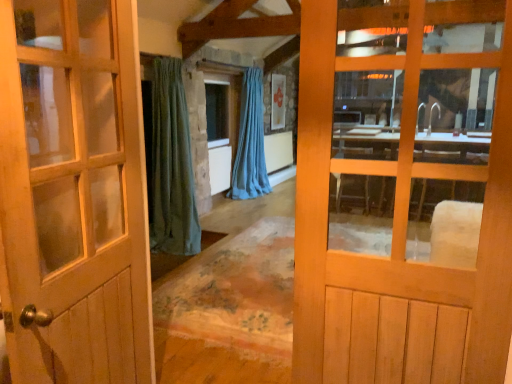
You are a GUI agent. You are given a task and a screenshot of the screen. Output one action in this format:
    pyautogui.click(x=<x>, y=<y>)
    Task: Click on the light brown wooden door at center, which is counted as the 2th door, starting from the left
    This screenshot has height=384, width=512.
    Given the screenshot: What is the action you would take?
    pyautogui.click(x=398, y=230)

What is the approximate width of blue fabric curtain at center?

blue fabric curtain at center is 22.01 inches in width.

The height and width of the screenshot is (384, 512). Find the location of `matte wooden door at center, positioned as the 2th door in right-to-left order`. matte wooden door at center, positioned as the 2th door in right-to-left order is located at coordinates (79, 214).

What do you see at coordinates (79, 214) in the screenshot? I see `matte wooden door at center, the first door in the left-to-right sequence` at bounding box center [79, 214].

The width and height of the screenshot is (512, 384). In order to click on clear glass window at center in this screenshot , I will do `click(223, 109)`.

You are a GUI agent. You are given a task and a screenshot of the screen. Output one action in this format:
    pyautogui.click(x=<x>, y=<y>)
    Task: Click on the light brown wooden door at center, which is counted as the 2th door, starting from the left
    This screenshot has height=384, width=512.
    Given the screenshot: What is the action you would take?
    pyautogui.click(x=398, y=230)

Considering the sizes of clear glass window at center and matte wooden door at center, the first door in the left-to-right sequence, in the image, is clear glass window at center taller or shorter than matte wooden door at center, the first door in the left-to-right sequence,?

Clearly, clear glass window at center is shorter compared to matte wooden door at center, the first door in the left-to-right sequence.

Is clear glass window at center looking in the opposite direction of matte wooden door at center, the first door in the left-to-right sequence?

clear glass window at center does not have its back to matte wooden door at center, the first door in the left-to-right sequence.

Can you confirm if clear glass window at center is positioned to the right of matte wooden door at center, the first door in the left-to-right sequence?

In fact, clear glass window at center is to the left of matte wooden door at center, the first door in the left-to-right sequence.

Which object is further away from the camera, clear glass window at center or matte wooden door at center, the first door in the left-to-right sequence?

clear glass window at center is further away from the camera.

How much distance is there between blue fabric curtain at center and matte wooden door at center, positioned as the 2th door in right-to-left order?

They are 15.05 feet apart.

Is blue fabric curtain at center inside the boundaries of matte wooden door at center, the first door in the left-to-right sequence, or outside?

blue fabric curtain at center is not enclosed by matte wooden door at center, the first door in the left-to-right sequence.

Which of these two, blue fabric curtain at center or matte wooden door at center, the first door in the left-to-right sequence, is thinner?

matte wooden door at center, the first door in the left-to-right sequence, is thinner.

Are light brown wooden door at center, which is counted as the 2th door, starting from the left, and blue fabric curtain at center beside each other?

No.

Does point (486, 171) appear closer or farther from the camera than point (245, 104)?

Point (486, 171).

Find the location of `curtain that appears above the light brown wooden door at center, acting as the 1th door starting from the right (from the image's perspective)`. curtain that appears above the light brown wooden door at center, acting as the 1th door starting from the right (from the image's perspective) is located at coordinates (250, 142).

From a real-world perspective, is blue fabric curtain at center positioned above or below clear glass window at center?

Clearly, from a real-world perspective, blue fabric curtain at center is below clear glass window at center.

Find the location of a particular element. This screenshot has height=384, width=512. curtain on the right of clear glass window at center is located at coordinates (250, 142).

Considering the sizes of objects blue fabric curtain at center and clear glass window at center in the image provided, who is taller, blue fabric curtain at center or clear glass window at center?

With more height is blue fabric curtain at center.

From the image's perspective, which is above, clear glass window at center or light brown wooden door at center, acting as the 1th door starting from the right?

clear glass window at center, from the image's perspective.

In order to click on window located above the light brown wooden door at center, acting as the 1th door starting from the right (from a real-world perspective) in this screenshot , I will do `click(223, 109)`.

From a real-world perspective, who is located lower, clear glass window at center or light brown wooden door at center, which is counted as the 2th door, starting from the left?

light brown wooden door at center, which is counted as the 2th door, starting from the left, from a real-world perspective.

Is clear glass window at center smaller than light brown wooden door at center, which is counted as the 2th door, starting from the left?

Correct, clear glass window at center occupies less space than light brown wooden door at center, which is counted as the 2th door, starting from the left.

Considering the positions of point (252, 126) and point (295, 230), is point (252, 126) closer or farther from the camera than point (295, 230)?

Point (252, 126) is positioned farther from the camera compared to point (295, 230).

Is the depth of blue fabric curtain at center less than that of light brown wooden door at center, which is counted as the 2th door, starting from the left?

No, the depth of blue fabric curtain at center is greater than that of light brown wooden door at center, which is counted as the 2th door, starting from the left.

Considering the sizes of objects blue fabric curtain at center and light brown wooden door at center, which is counted as the 2th door, starting from the left, in the image provided, who is taller, blue fabric curtain at center or light brown wooden door at center, which is counted as the 2th door, starting from the left,?

With more height is blue fabric curtain at center.

From a real-world perspective, who is located higher, blue fabric curtain at center or light brown wooden door at center, which is counted as the 2th door, starting from the left?

light brown wooden door at center, which is counted as the 2th door, starting from the left, from a real-world perspective.

From a real-world perspective, is matte wooden door at center, the first door in the left-to-right sequence, beneath blue fabric curtain at center?

No, from a real-world perspective, matte wooden door at center, the first door in the left-to-right sequence, is not below blue fabric curtain at center.

Which is more to the right, matte wooden door at center, the first door in the left-to-right sequence, or blue fabric curtain at center?

blue fabric curtain at center.

Starting from the blue fabric curtain at center, which door is the 2nd one in front? Please provide its 2D coordinates.

[(79, 214)]

In terms of height, does matte wooden door at center, the first door in the left-to-right sequence, look taller or shorter compared to blue fabric curtain at center?

matte wooden door at center, the first door in the left-to-right sequence, is shorter than blue fabric curtain at center.

Where is `the 2nd door below when counting from the clear glass window at center (from the image's perspective)`? This screenshot has width=512, height=384. the 2nd door below when counting from the clear glass window at center (from the image's perspective) is located at coordinates (79, 214).

This screenshot has height=384, width=512. I want to click on the 1st door directly above the blue fabric curtain at center (from a real-world perspective), so click(x=79, y=214).

Considering their positions, is clear glass window at center positioned closer to light brown wooden door at center, acting as the 1th door starting from the right, than blue fabric curtain at center?

The object closer to light brown wooden door at center, acting as the 1th door starting from the right, is blue fabric curtain at center.

When comparing their distances from light brown wooden door at center, which is counted as the 2th door, starting from the left, does matte wooden door at center, the first door in the left-to-right sequence, or blue fabric curtain at center seem further?

blue fabric curtain at center lies further to light brown wooden door at center, which is counted as the 2th door, starting from the left, than the other object.

Estimate the real-world distances between objects in this image. Which object is closer to matte wooden door at center, positioned as the 2th door in right-to-left order, blue fabric curtain at center or light brown wooden door at center, which is counted as the 2th door, starting from the left?

light brown wooden door at center, which is counted as the 2th door, starting from the left, is positioned closer to the anchor matte wooden door at center, positioned as the 2th door in right-to-left order.

Estimate the real-world distances between objects in this image. Which object is further from clear glass window at center, light brown wooden door at center, acting as the 1th door starting from the right, or matte wooden door at center, the first door in the left-to-right sequence?

Based on the image, light brown wooden door at center, acting as the 1th door starting from the right, appears to be further to clear glass window at center.

Which object lies nearer to the anchor point blue fabric curtain at center, matte wooden door at center, positioned as the 2th door in right-to-left order, or clear glass window at center?

Among the two, clear glass window at center is located nearer to blue fabric curtain at center.

Looking at the image, which one is located further to clear glass window at center, blue fabric curtain at center or light brown wooden door at center, which is counted as the 2th door, starting from the left?

light brown wooden door at center, which is counted as the 2th door, starting from the left, lies further to clear glass window at center than the other object.

Considering their positions, is clear glass window at center positioned closer to matte wooden door at center, the first door in the left-to-right sequence, than blue fabric curtain at center?

The object closer to matte wooden door at center, the first door in the left-to-right sequence, is blue fabric curtain at center.

Estimate the real-world distances between objects in this image. Which object is closer to blue fabric curtain at center, clear glass window at center or light brown wooden door at center, which is counted as the 2th door, starting from the left?

Based on the image, clear glass window at center appears to be nearer to blue fabric curtain at center.

Find the location of a particular element. window located between matte wooden door at center, positioned as the 2th door in right-to-left order, and blue fabric curtain at center in the depth direction is located at coordinates point(223,109).

Where is `window located between light brown wooden door at center, which is counted as the 2th door, starting from the left, and blue fabric curtain at center in the depth direction`? The image size is (512, 384). window located between light brown wooden door at center, which is counted as the 2th door, starting from the left, and blue fabric curtain at center in the depth direction is located at coordinates (223, 109).

Where is `door positioned between matte wooden door at center, the first door in the left-to-right sequence, and clear glass window at center from near to far`? The width and height of the screenshot is (512, 384). door positioned between matte wooden door at center, the first door in the left-to-right sequence, and clear glass window at center from near to far is located at coordinates (398, 230).

The height and width of the screenshot is (384, 512). In order to click on door located between matte wooden door at center, the first door in the left-to-right sequence, and blue fabric curtain at center in the depth direction in this screenshot , I will do `click(398, 230)`.